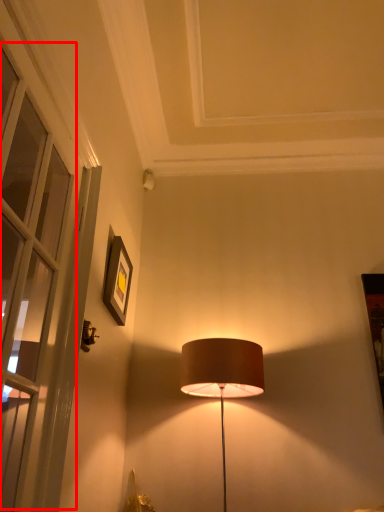
Question: From the image's perspective, what is the correct spatial relationship of window (annotated by the red box) in relation to picture frame?

Choices:
 (A) above
 (B) below

Answer: (A)